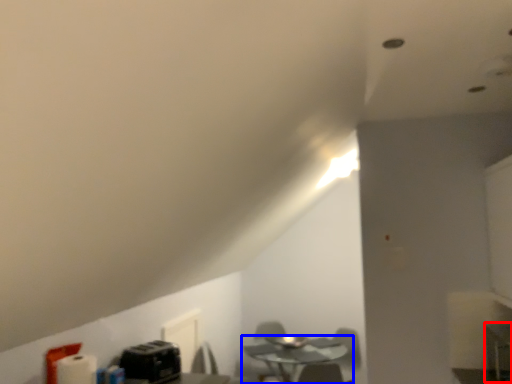
Question: Which object appears closest to the camera in this image, computer desk (highlighted by a red box) or table (highlighted by a blue box)?

Choices:
 (A) computer desk
 (B) table

Answer: (A)